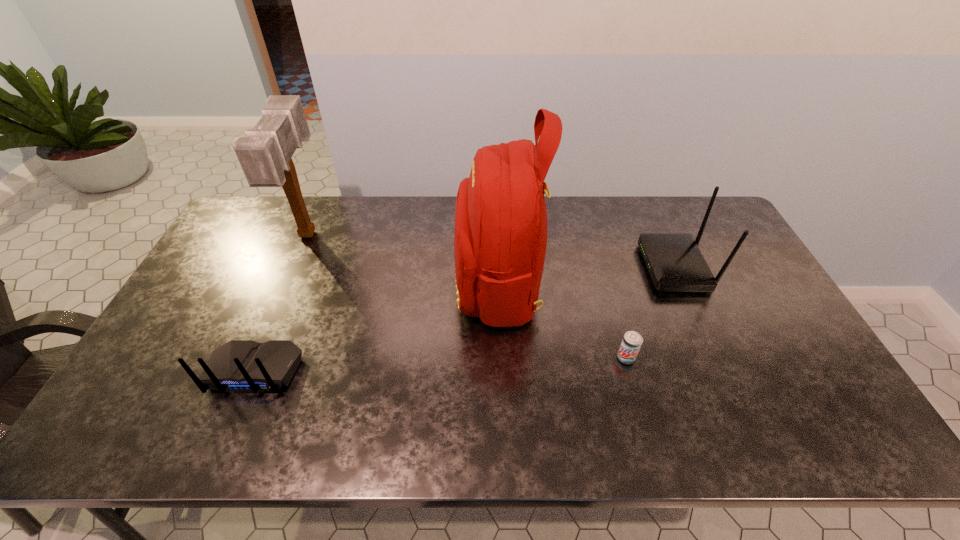
Identify which object is located as the fourth nearest to the fourth shortest object. Please provide its 2D coordinates. Your answer should be formatted as a tuple, i.e. [(x, y)], where the tuple contains the x and y coordinates of a point satisfying the conditions above.

[(675, 263)]

Where is `object that is the third closest to the fourth shortest object`? object that is the third closest to the fourth shortest object is located at coordinates (x=632, y=341).

This screenshot has height=540, width=960. Identify the location of free location that satisfies the following two spatial constraints: 1. on the front-facing side of the third object from left to right; 2. on the back of the left router. (502, 371).

Where is `vacant position in the image that satisfies the following two spatial constraints: 1. on the front-facing side of the backpack; 2. on the back of the fourth tallest object`? This screenshot has width=960, height=540. vacant position in the image that satisfies the following two spatial constraints: 1. on the front-facing side of the backpack; 2. on the back of the fourth tallest object is located at coordinates (502, 371).

You are a GUI agent. You are given a task and a screenshot of the screen. Output one action in this format:
    pyautogui.click(x=<x>, y=<y>)
    Task: Click on the free point that satisfies the following two spatial constraints: 1. on the front-facing side of the right router; 2. on the front side of the shortest object
    The height and width of the screenshot is (540, 960).
    Given the screenshot: What is the action you would take?
    pyautogui.click(x=715, y=358)

Identify the location of vacant point that satisfies the following two spatial constraints: 1. on the front-facing side of the third shortest object; 2. on the front side of the shortest object. (715, 358).

You are a GUI agent. You are given a task and a screenshot of the screen. Output one action in this format:
    pyautogui.click(x=<x>, y=<y>)
    Task: Click on the free space that satisfies the following two spatial constraints: 1. on the front-facing side of the shortest object; 2. on the right side of the tallest object
    
    Given the screenshot: What is the action you would take?
    pyautogui.click(x=501, y=358)